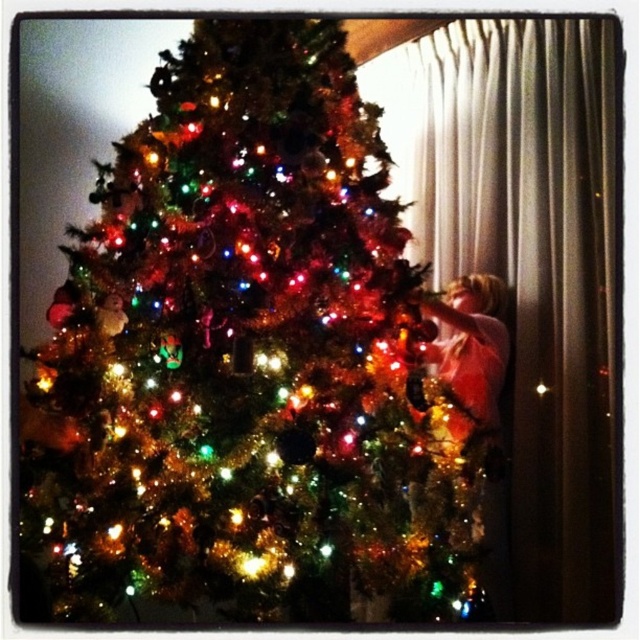
Based on the photo, which is below, iridescent shiny tree at center or shiny gold dress at right?

shiny gold dress at right is lower down.

Who is more distant from viewer, (342, 93) or (486, 378)?

Point (486, 378)

Who is more distant from viewer, (76, 577) or (465, 291)?

The point (465, 291) is more distant.

Locate an element on the screen. This screenshot has width=640, height=640. iridescent shiny tree at center is located at coordinates (244, 364).